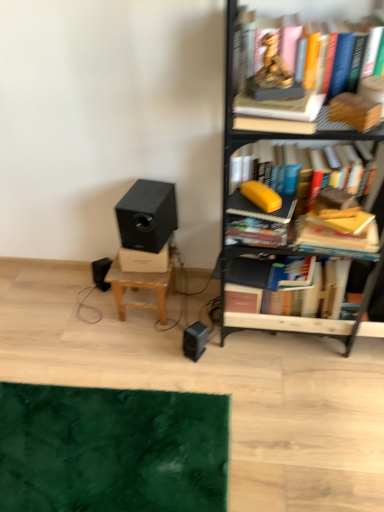
Where is `vacant area that is in front of wooden stool at lower center`? This screenshot has height=512, width=384. vacant area that is in front of wooden stool at lower center is located at coordinates (145, 348).